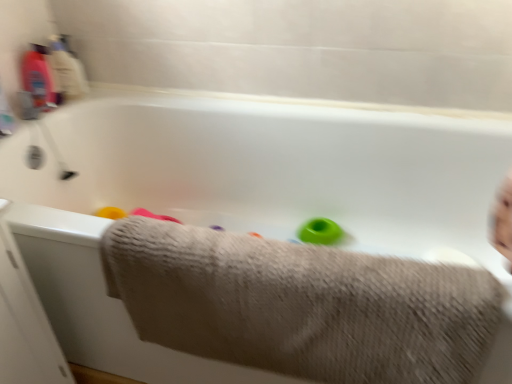
Question: Considering the positions of point (310, 228) and point (472, 359), is point (310, 228) closer or farther from the camera than point (472, 359)?

Choices:
 (A) farther
 (B) closer

Answer: (A)

Question: From their relative heights in the image, would you say green rubber ring at center is taller or shorter than beige textured towel at lower center?

Choices:
 (A) short
 (B) tall

Answer: (A)

Question: Which is nearer to the green rubber ring at center?

Choices:
 (A) beige textured towel at lower center
 (B) translucent plastic bottle at upper left

Answer: (A)

Question: Estimate the real-world distances between objects in this image. Which object is closer to the green rubber ring at center?

Choices:
 (A) translucent plastic bottle at upper left
 (B) beige textured towel at lower center

Answer: (B)